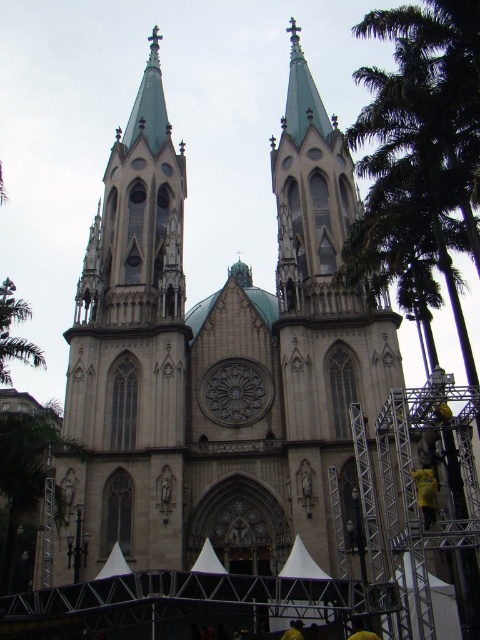
You are a photographer planning to take a wide shot of the cathedral and the surrounding area. You want to ensure both the matte stone tower at center and the green leafy tree at left are clearly visible in the frame. Given their sizes, which object will occupy more space in the photo?

The matte stone tower at center will occupy more space in the photo because it has a larger size compared to the green leafy tree at left.

You are a stagehand setting up lights for an outdoor event. You have two green leafy trees in front of the cathedral. The green leafy palm tree at right and the green leafy tree at left. Which tree has a wider spread of branches?

The green leafy palm tree at right has a wider spread of branches than the green leafy tree at left.